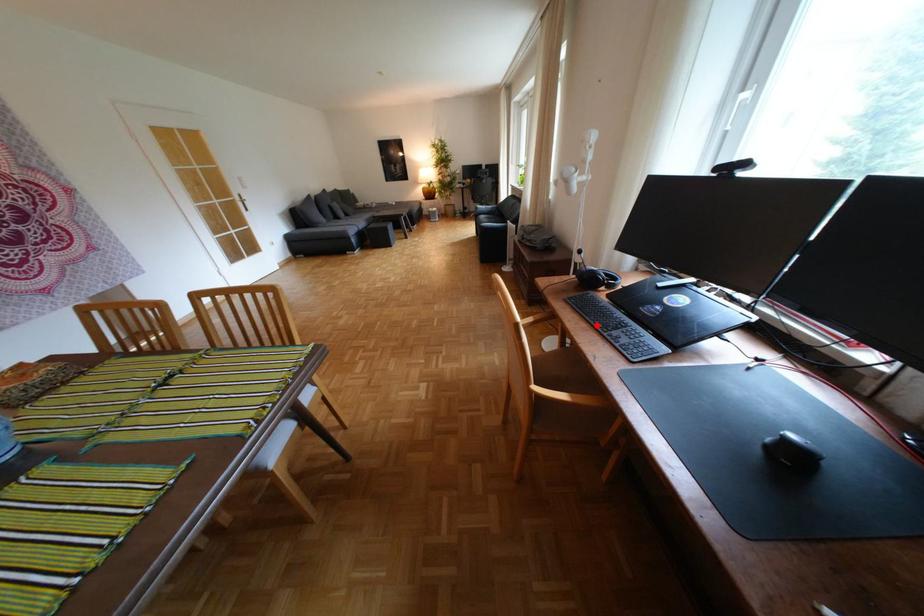
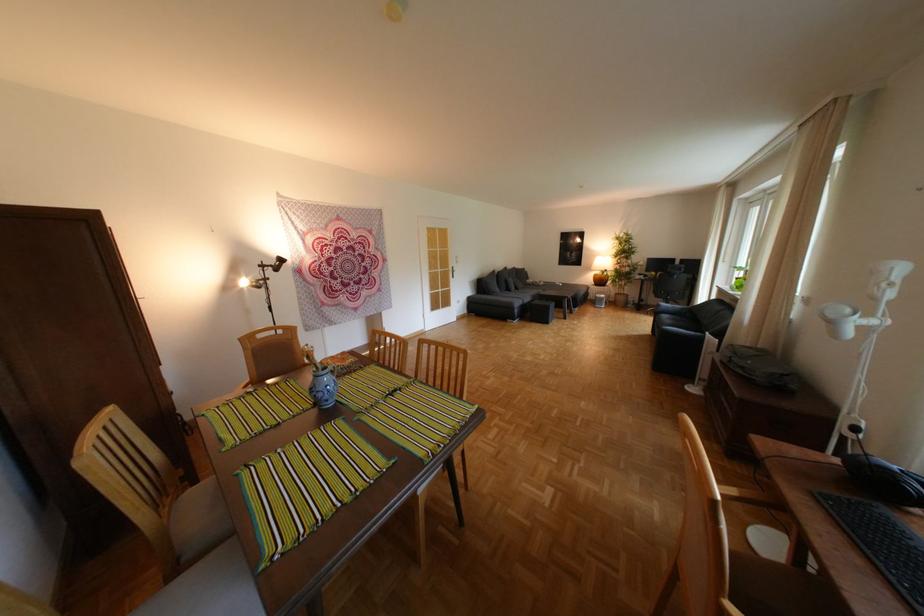
Find the pixel in the second image that matches the highlighted location in the first image.

(870, 560)